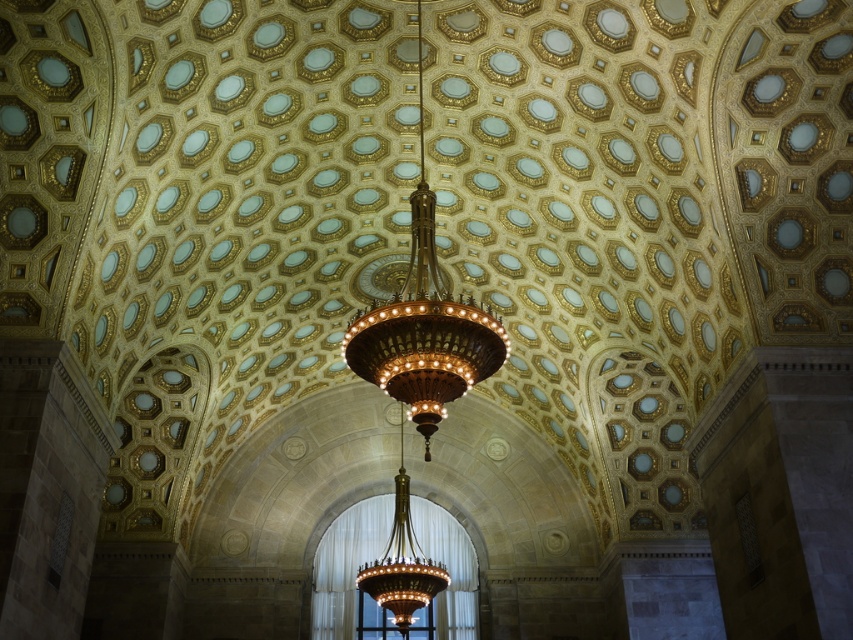
You are an interior designer planning to install a third chandelier in this grand room. The existing polished brass chandelier at center and gold metallic chandelier at center are both hanging from the ceiling. Which chandelier is located higher up in the room?

The polished brass chandelier at center is positioned over the gold metallic chandelier at center, so the polished brass chandelier at center is higher up in the room.

You are standing in the center of the room and want to walk towards the polished brass chandelier at center. Which direction should you move relative to the gold metallic chandelier at center?

The polished brass chandelier at center is to the right of the gold metallic chandelier at center, so you should move to the right relative to the gold metallic chandelier at center to reach it.

You are standing in the center of the room and want to look up at the ceiling. Which object from the list would you see directly above you? Please choose from the objects listed. The objects are the polished brass chandelier at center and the honeycomb pattern ceiling.

The polished brass chandelier at center is located at point (424, 323), which is nearly the center of the room. Since you are standing in the center, looking up would place the polished brass chandelier at center directly above you.